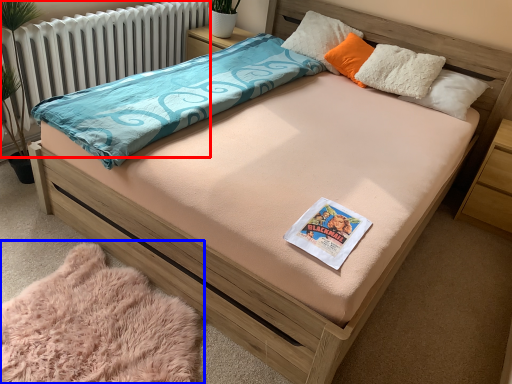
Question: Among these objects, which one is nearest to the camera, radiator (highlighted by a red box) or blanket (highlighted by a blue box)?

Choices:
 (A) radiator
 (B) blanket

Answer: (B)